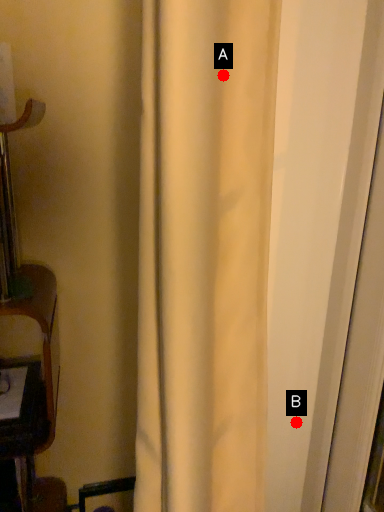
Question: Two points are circled on the image, labeled by A and B beside each circle. Which point is farther from the camera taking this photo?

Choices:
 (A) A is further
 (B) B is further

Answer: (B)